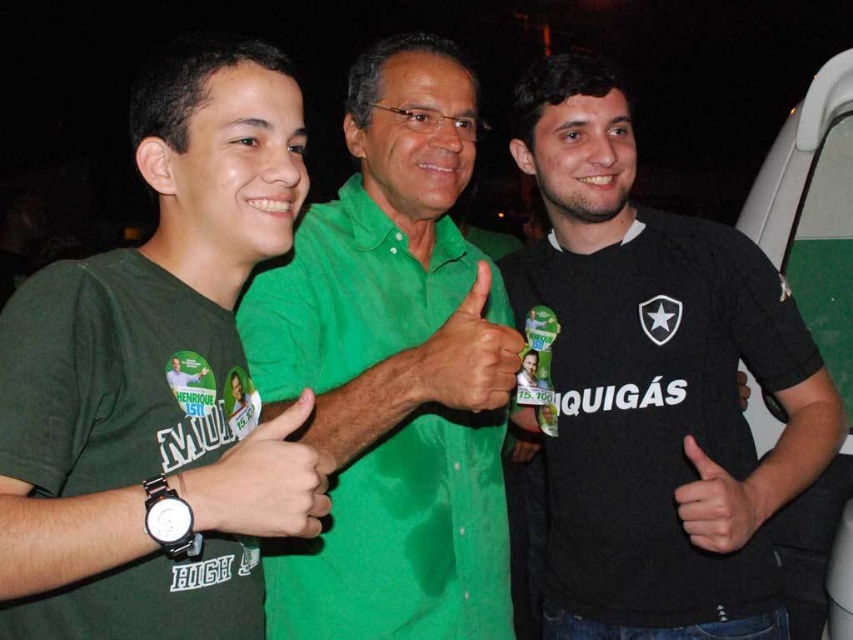
Question: Among these points, which one is nearest to the camera?

Choices:
 (A) (213, 483)
 (B) (241, 524)
 (C) (434, 621)

Answer: (A)

Question: Does green matte shirt at left have a greater width compared to black matte hand at center?

Choices:
 (A) no
 (B) yes

Answer: (B)

Question: Can you confirm if green matte shirt at left is bigger than black matte hand at center?

Choices:
 (A) yes
 (B) no

Answer: (A)

Question: Which object is positioned closest to the black matte wristwatch at center?

Choices:
 (A) green matte shirt at left
 (B) green linen shirt at center
 (C) black jersey at center
 (D) black matte hand at center

Answer: (A)

Question: Is black jersey at center to the left of black matte hand at center from the viewer's perspective?

Choices:
 (A) yes
 (B) no

Answer: (A)

Question: Which object appears farthest from the camera in this image?

Choices:
 (A) matte black hand at center
 (B) black matte hand at center

Answer: (A)